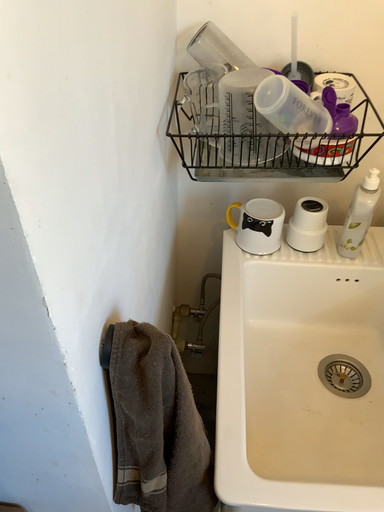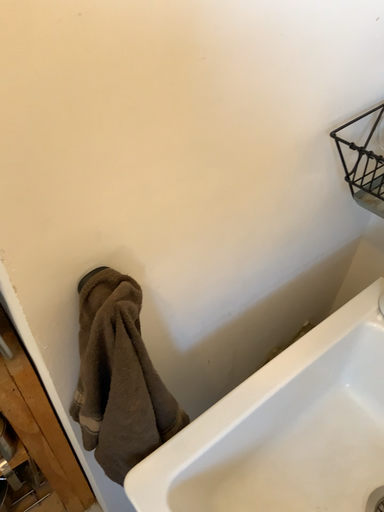
Question: Which way did the camera rotate in the video?

Choices:
 (A) rotated left
 (B) rotated right

Answer: (A)